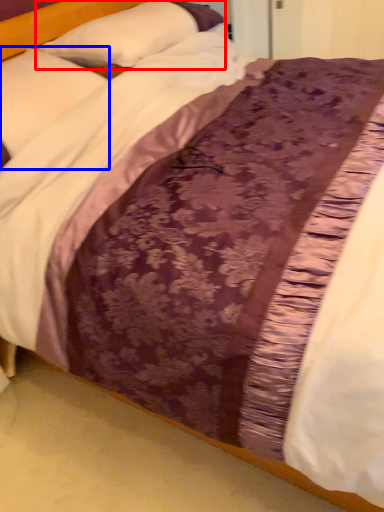
Question: Which of the following is the closest to the observer, pillow (highlighted by a red box) or pillow (highlighted by a blue box)?

Choices:
 (A) pillow
 (B) pillow

Answer: (B)